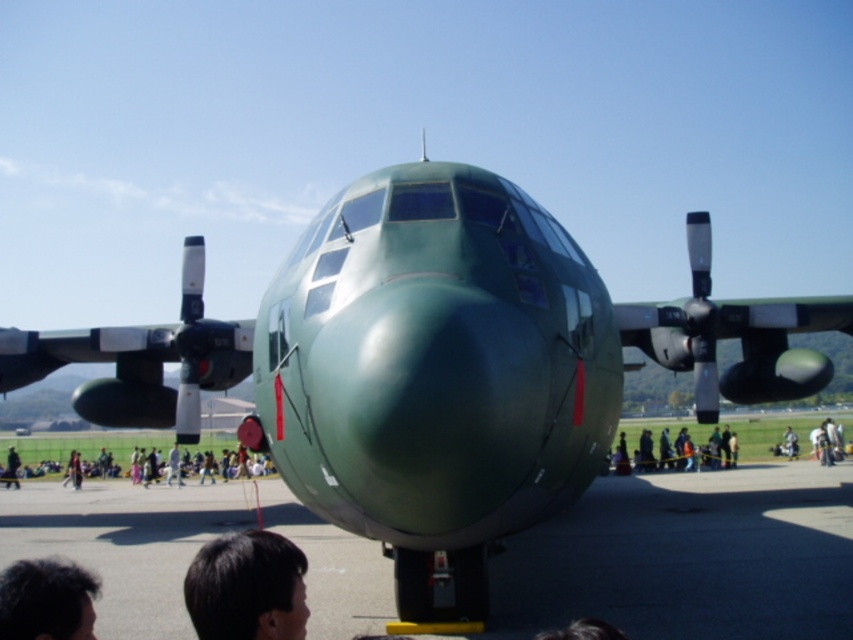
You are a photographer at the airshow and want to capture both the black hair at lower left and the dark brown hair at lower left in a single frame. Which person should you focus on first to ensure both are in the shot?

You should focus on the black hair at lower left first because it is larger and will be easier to frame, ensuring the smaller dark brown hair at lower left is also captured in the shot.

You are at an airshow and see the light brown fabric jacket at lower left and the green matte airplane at center. Which object is positioned more to the left side of the image?

The light brown fabric jacket at lower left is positioned more to the left side of the image than the green matte airplane at center.